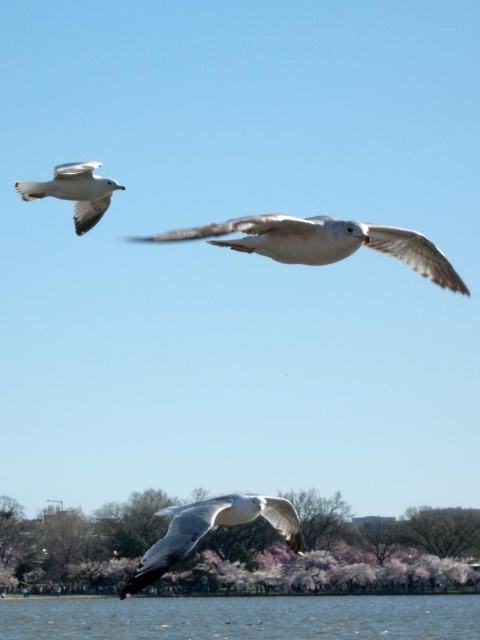
You are a birdwatcher standing on the lakeshore. You see two birds in the sky, the white feathered bird at center and the white feathered bird at lower center. Which one is farther away from you?

The white feathered bird at center is farther away from you since it is 89.58 feet away from the white feathered bird at lower center, which is closer to you.

You are standing at the camera position and want to take a photo of the white feathered bird at center. If your camera has a maximum focus range of 20 meters, will you be able to focus on the bird?

The white feathered bird at center is 22.51 meters from camera, which exceeds the camera maximum focus range of 20 meters, so you cannot focus on the bird.

You are standing in the scene and want to take a photo of the white feathered bird at lower center without the pink blossoming tree at lower center blocking the view. Which direction should you move to ensure the tree is no longer in the frame?

Move to the right so the white feathered bird at lower center is to the left of the pink blossoming tree at lower center, thus avoiding the tree blocking the view.